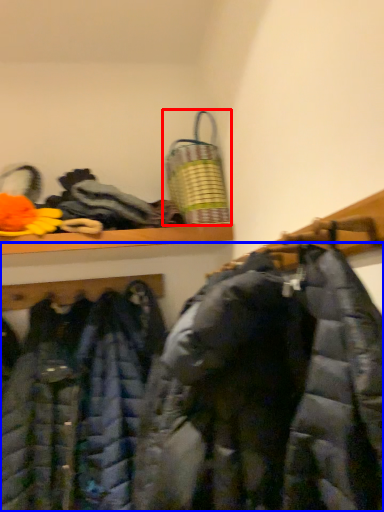
Question: Which object is closer to the camera taking this photo, laundry basket (highlighted by a red box) or jacket (highlighted by a blue box)?

Choices:
 (A) laundry basket
 (B) jacket

Answer: (B)